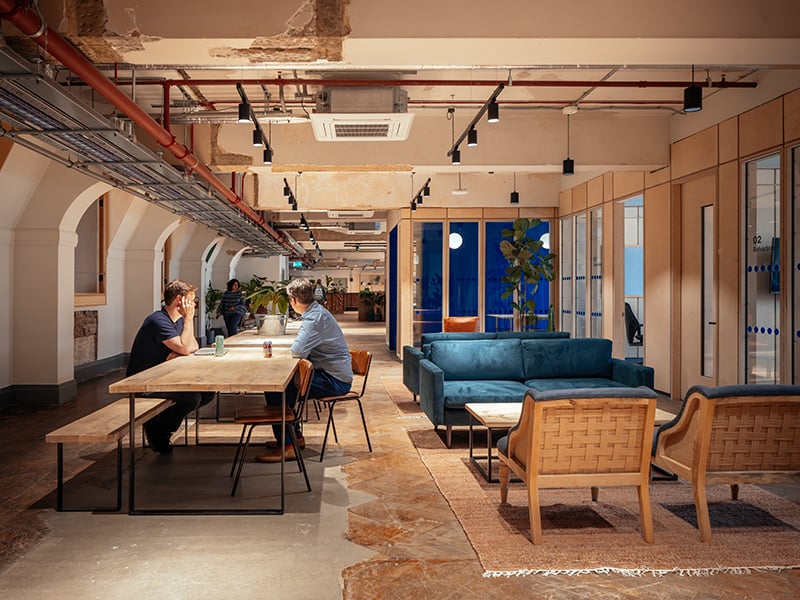
At what (x,y) coordinates should I click in order to perform the action: click on lights. Please return your answer as a coordinate pair (x, y). The height and width of the screenshot is (600, 800). Looking at the image, I should click on (490, 115), (470, 142), (454, 159), (242, 120), (254, 142), (266, 160).